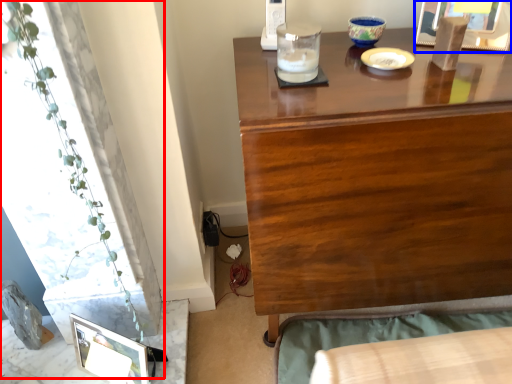
Question: Which point is further to the camera, plant (highlighted by a red box) or picture frame (highlighted by a blue box)?

Choices:
 (A) plant
 (B) picture frame

Answer: (B)